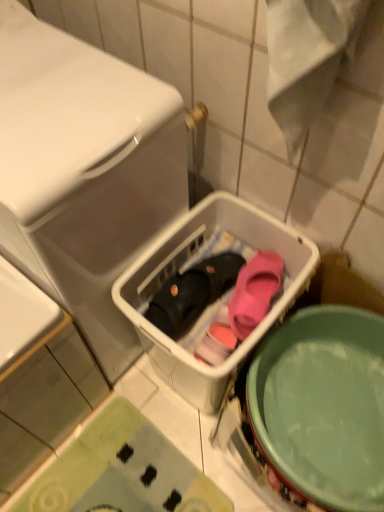
Identify the location of vacant space situated above green textured bath mat at lower left (from a real-world perspective). (129, 476).